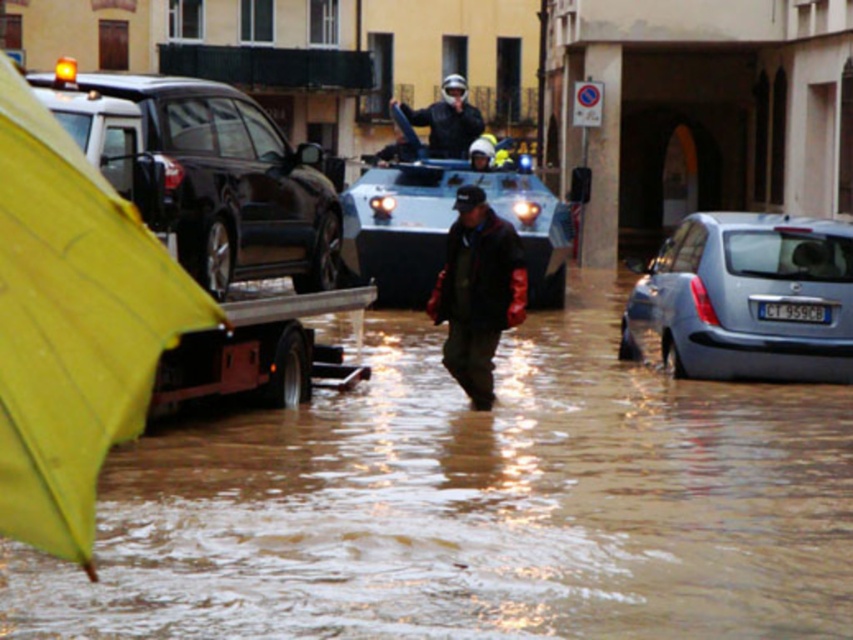
You are a rescue worker in the flooded area. You need to reach the silver metallic car at lower right. The coordinates given are point (747, 298). Is this point the correct location of the silver metallic car at lower right?

Yes, the point (747, 298) corresponds to the silver metallic car at lower right, so it is the correct location.

You are standing at the origin point of the coordinate system in this flooded street scene. You need to determine which of the two points, point (x=370, y=358) or point (x=3, y=332), is closer to you. Which point is closer?

Point (x=370, y=358) is further to the viewer than point (x=3, y=332), so the closer point to you is point (x=3, y=332).